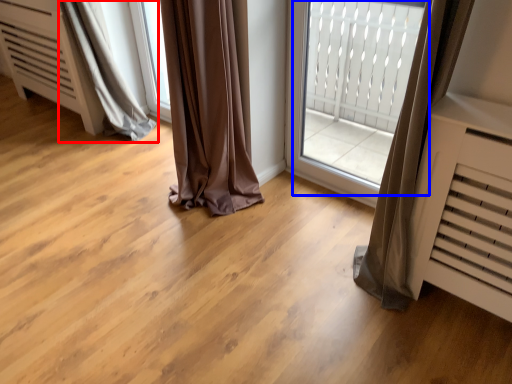
Question: Among these objects, which one is farthest to the camera, curtain (highlighted by a red box) or bay window (highlighted by a blue box)?

Choices:
 (A) curtain
 (B) bay window

Answer: (A)